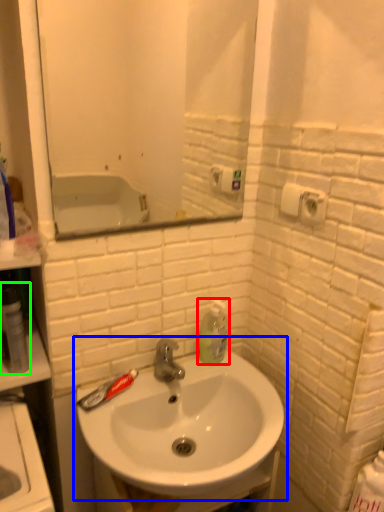
Question: Based on their relative distances, which object is farther from soap dispenser (highlighted by a red box)? Choose from sink (highlighted by a blue box) and mouthwash (highlighted by a green box).

Choices:
 (A) sink
 (B) mouthwash

Answer: (B)